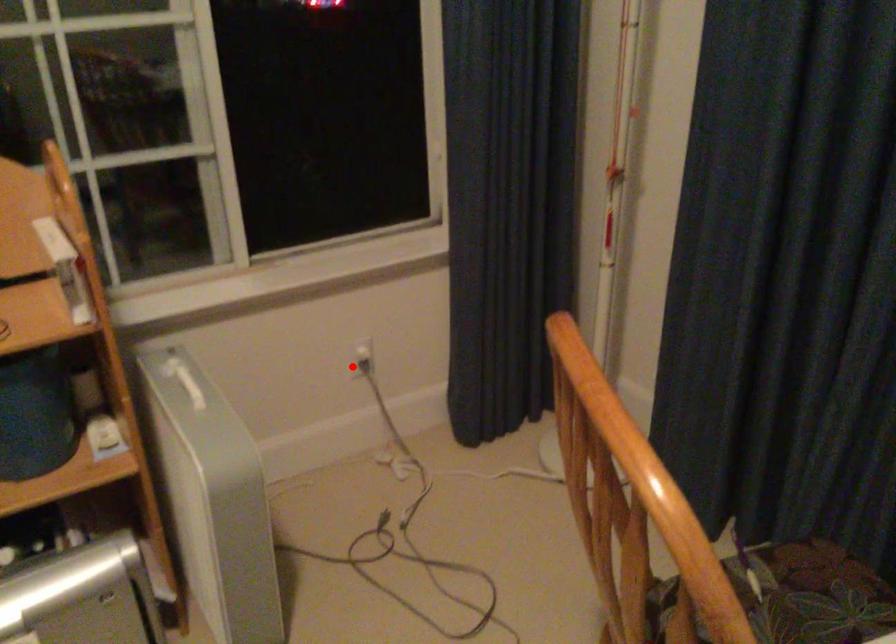
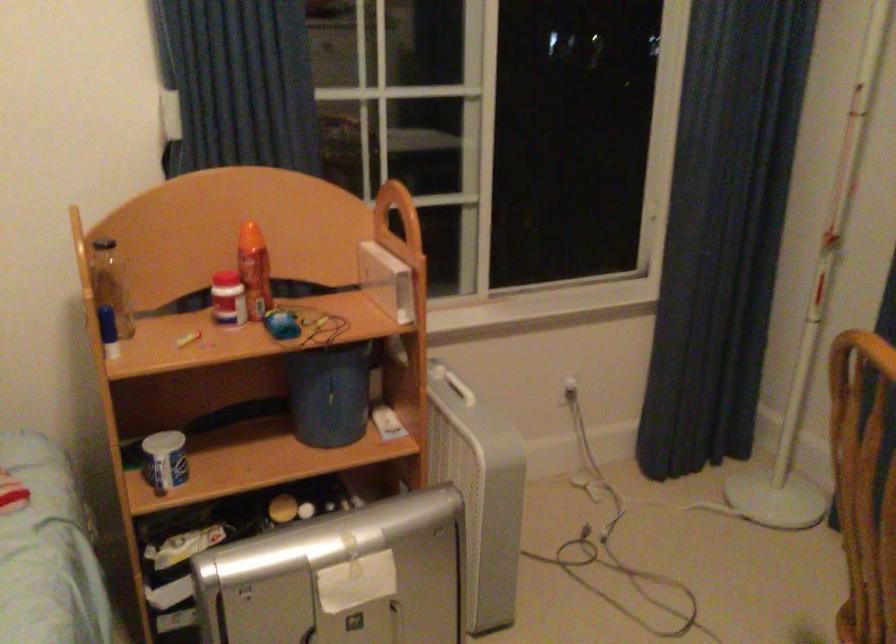
Question: I am providing you with two images of the same scene from different viewpoints. Given a red point in image1, look at the same physical point in image2. Is it:

Choices:
 (A) Closer to the viewpoint
 (B) Farther from the viewpoint

Answer: (B)